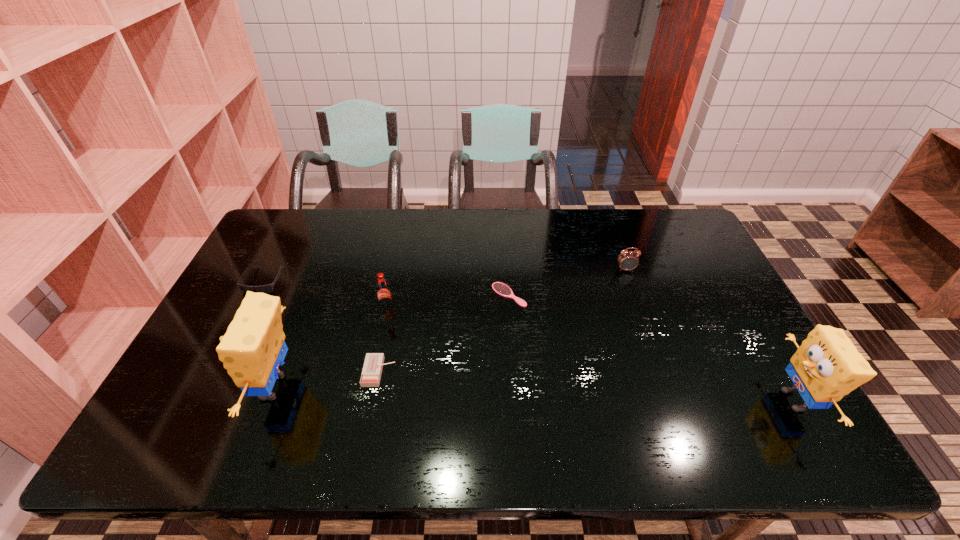
Identify the location of vacant area between the left sponge and the rightmost object. This screenshot has height=540, width=960. (534, 394).

At what (x,y) coordinates should I click in order to perform the action: click on free space that is in between the rightmost object and the root beer. Please return your answer as a coordinate pair (x, y). The height and width of the screenshot is (540, 960). Looking at the image, I should click on (590, 354).

This screenshot has height=540, width=960. Identify the location of empty location between the shorter sponge and the leftmost object. (529, 340).

What are the coordinates of `the sixth closest object to the right sponge` in the screenshot? It's located at (268, 288).

Choose which object is the nearest neighbor to the fifth shortest object. Please provide its 2D coordinates. Your answer should be formatted as a tuple, i.e. [(x, y)], where the tuple contains the x and y coordinates of a point satisfying the conditions above.

[(371, 374)]

Locate an element on the screen. The width and height of the screenshot is (960, 540). free space that satisfies the following two spatial constraints: 1. on the front-facing side of the fifth shortest object; 2. on the right side of the fifth tallest object is located at coordinates (250, 309).

This screenshot has height=540, width=960. What are the coordinates of `vacant space that satisfies the following two spatial constraints: 1. on the face of the fourth tallest object; 2. on the face of the tallest object` in the screenshot? It's located at (668, 387).